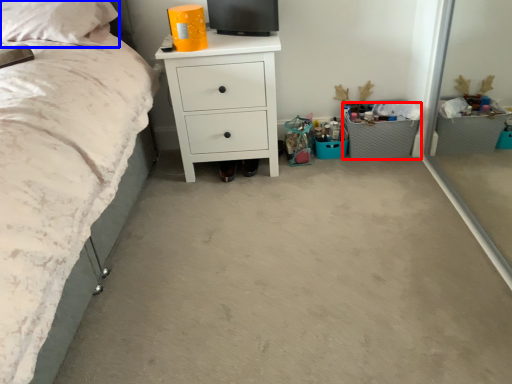
Question: Which object is closer to the camera taking this photo, crate (highlighted by a red box) or pillow (highlighted by a blue box)?

Choices:
 (A) crate
 (B) pillow

Answer: (B)